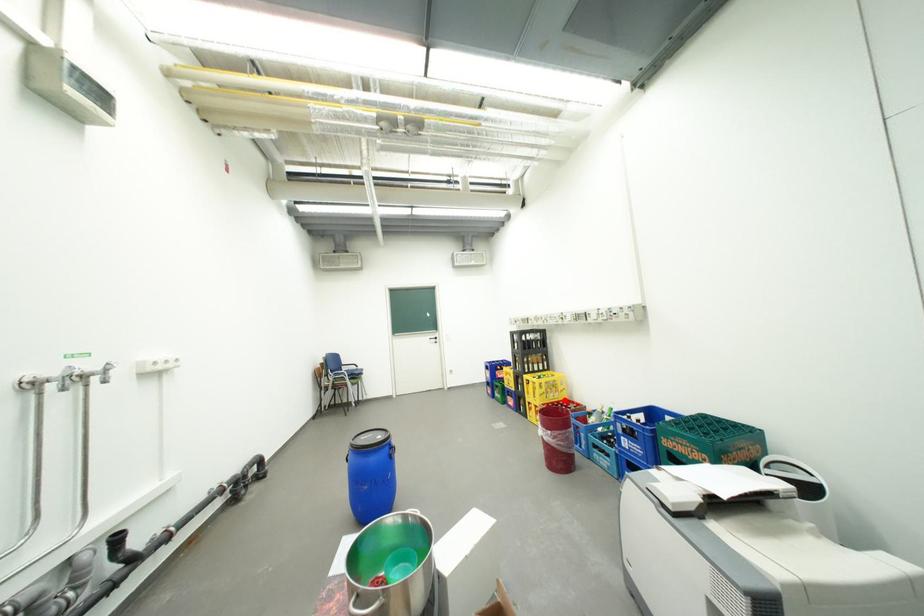
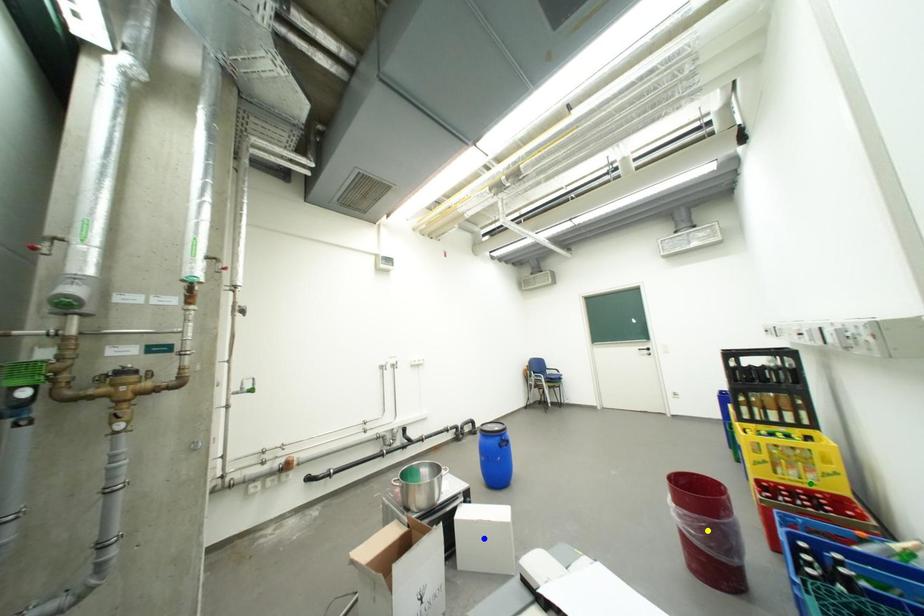
Question: I am providing you with two images of the same scene from different viewpoints. A red point is marked on the first image. You are given multiple points on the second image. Can you choose the point in image 2 that corresponds to the point in image 1?

Choices:
 (A) blue point
 (B) yellow point
 (C) green point

Answer: (C)